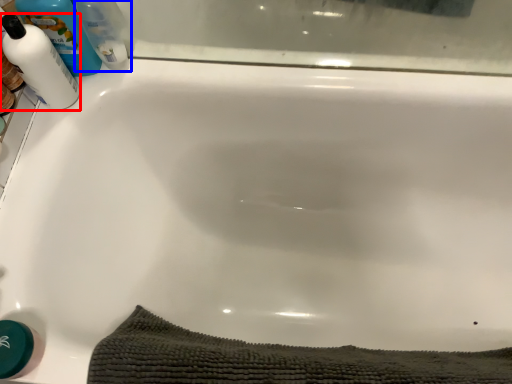
Question: Which object appears farthest to the camera in this image, cleaning product (highlighted by a red box) or cleaning product (highlighted by a blue box)?

Choices:
 (A) cleaning product
 (B) cleaning product

Answer: (B)